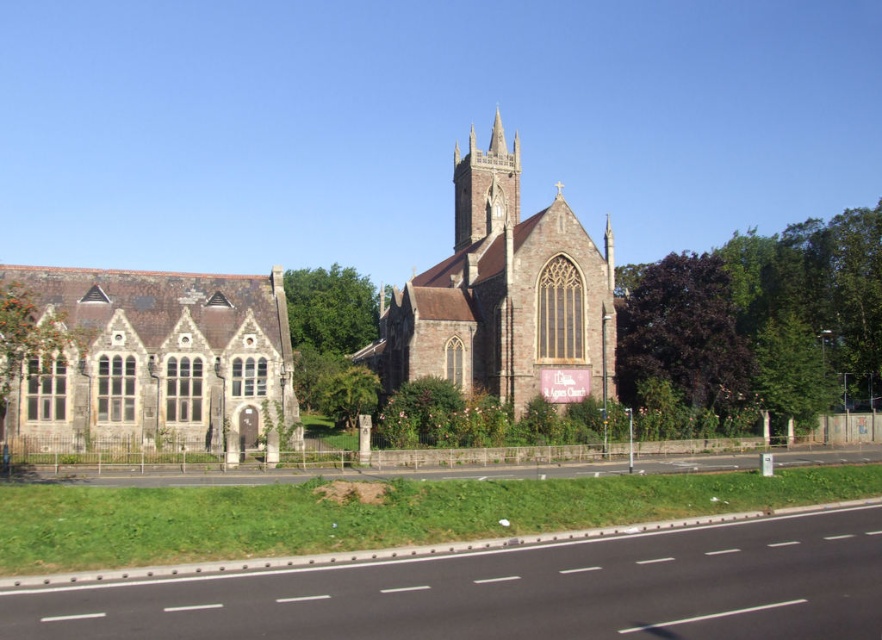
You are standing on the road in front of the historic church and want to take a photo of the brown stone church at center and the smooth brick spire at center. Which one will appear larger in your photo?

The brown stone church at center will appear larger in the photo because it is closer to the viewer than the smooth brick spire at center.

You are standing on the road in front of the historic church. You want to take a photo that includes both the stone church at left and a modern skyscraper that is 100 meters behind you. Can you step back far enough to include both in your photo without moving the camera position?

The stone church at left is 64.18 meters from the viewer. Since the modern skyscraper is 100 meters behind you, stepping back would place you further away from the church, potentially making both structures visible in the frame. However, the exact feasibility depends on the camera lens and field of view, but spatially, moving back 35.82 meters from the original position would allow both to be in the shot.

You are standing at the center of the road in front of the historic church. You want to take a photo of the stone church at left from the best possible angle. According to the scene description, where should you position yourself relative to the church to capture it fully in the frame?

The stone church at left is located at point (x=155, y=362), so positioning yourself directly in front and slightly to the right of the stone church at left would ensure the entire structure is captured in the photo.